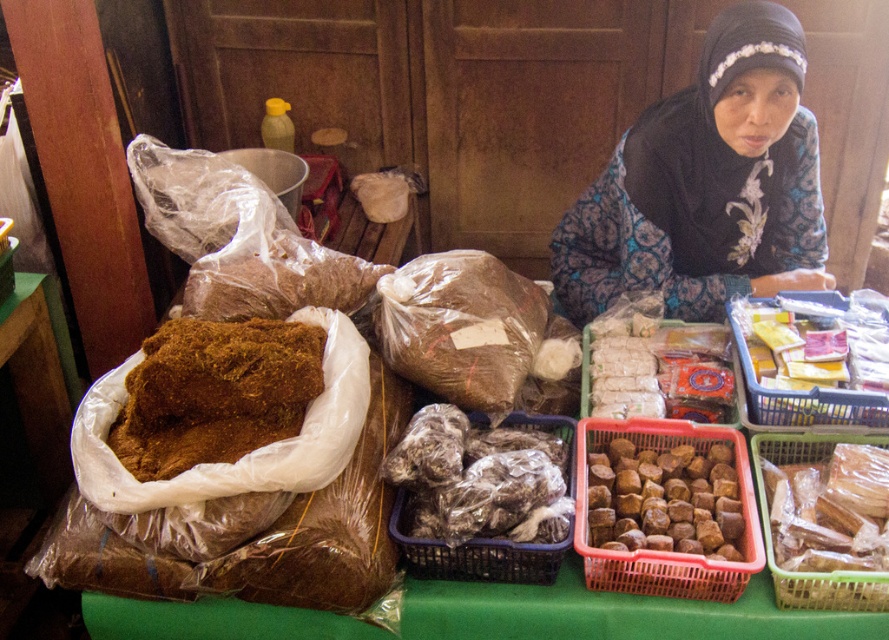
Is the position of black batik hijab at upper center less distant than that of translucent plastic basket at center?

No, it is not.

From the picture: Is black batik hijab at upper center to the right of translucent plastic basket at center from the viewer's perspective?

Yes, black batik hijab at upper center is to the right of translucent plastic basket at center.

Is point (661, 195) closer to viewer compared to point (505, 419)?

That is False.

The image size is (889, 640). In order to click on black batik hijab at upper center in this screenshot , I will do `click(706, 184)`.

Does point (259, 420) lie in front of point (657, 564)?

No, it is behind (657, 564).

Who is positioned more to the left, brown crumbly food at left or brown woven basket at center?

brown crumbly food at left

The width and height of the screenshot is (889, 640). Describe the element at coordinates (214, 392) in the screenshot. I see `brown crumbly food at left` at that location.

In order to click on brown crumbly food at left in this screenshot , I will do `click(214, 392)`.

Is brown woven basket at center shorter than translucent plastic basket at center?

Incorrect, brown woven basket at center's height does not fall short of translucent plastic basket at center's.

Is point (589, 577) behind point (546, 429)?

No, (589, 577) is closer to viewer.

Image resolution: width=889 pixels, height=640 pixels. I want to click on brown woven basket at center, so click(x=658, y=550).